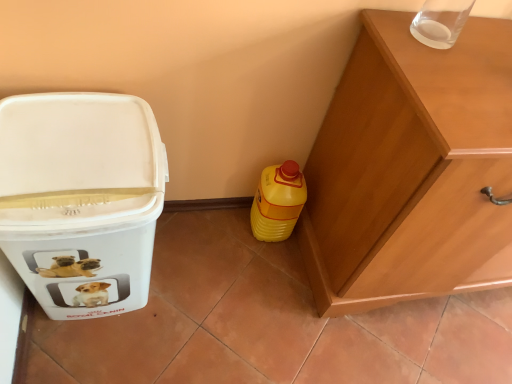
This screenshot has height=384, width=512. I want to click on vacant space in between wooden cabinet at right and yellow plastic bottle at lower right, so click(285, 269).